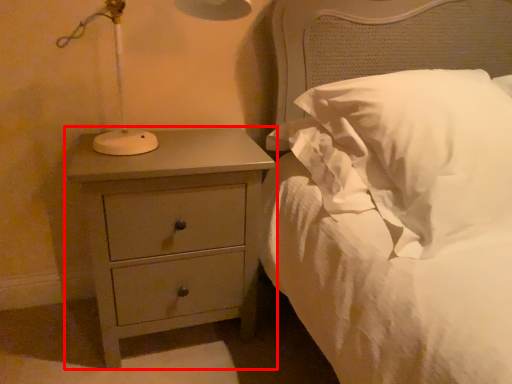
Question: Observing the image, what is the correct spatial positioning of chest of drawers (annotated by the red box) in reference to pillow?

Choices:
 (A) right
 (B) left

Answer: (B)